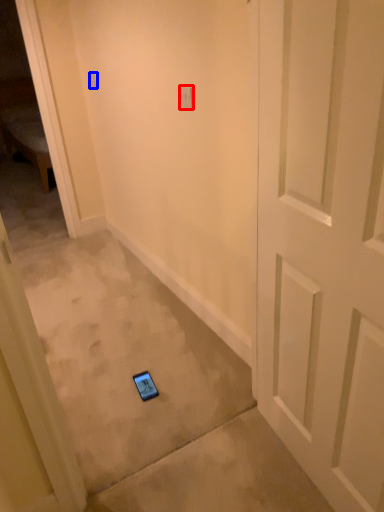
Question: Which object is further to the camera taking this photo, light switch (highlighted by a red box) or light switch (highlighted by a blue box)?

Choices:
 (A) light switch
 (B) light switch

Answer: (B)